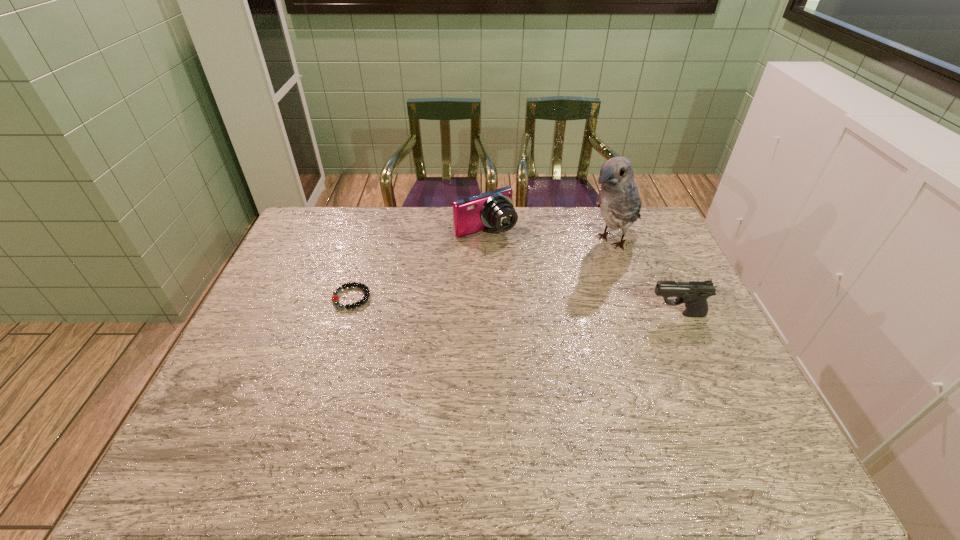
Locate an element on the screen. Image resolution: width=960 pixels, height=540 pixels. free space between the leftmost object and the pistol is located at coordinates (515, 306).

This screenshot has width=960, height=540. What are the coordinates of `vacant area between the camera and the leftmost object` in the screenshot? It's located at (419, 264).

Where is `free space that is in between the bracelet and the third object from right to left`? The image size is (960, 540). free space that is in between the bracelet and the third object from right to left is located at coordinates (419, 264).

You are a GUI agent. You are given a task and a screenshot of the screen. Output one action in this format:
    pyautogui.click(x=<x>, y=<y>)
    Task: Click on the free spot between the pistol and the shortest object
    Image resolution: width=960 pixels, height=540 pixels.
    Given the screenshot: What is the action you would take?
    pyautogui.click(x=515, y=306)

Locate an element on the screen. The width and height of the screenshot is (960, 540). the third closest object relative to the parrot is located at coordinates (335, 298).

This screenshot has width=960, height=540. Find the location of `the closest object to the tallest object`. the closest object to the tallest object is located at coordinates 494,209.

This screenshot has width=960, height=540. Find the location of `free space that satisfies the following two spatial constraints: 1. on the back side of the second object from left to right; 2. on the left side of the leftmost object`. free space that satisfies the following two spatial constraints: 1. on the back side of the second object from left to right; 2. on the left side of the leftmost object is located at coordinates (372, 231).